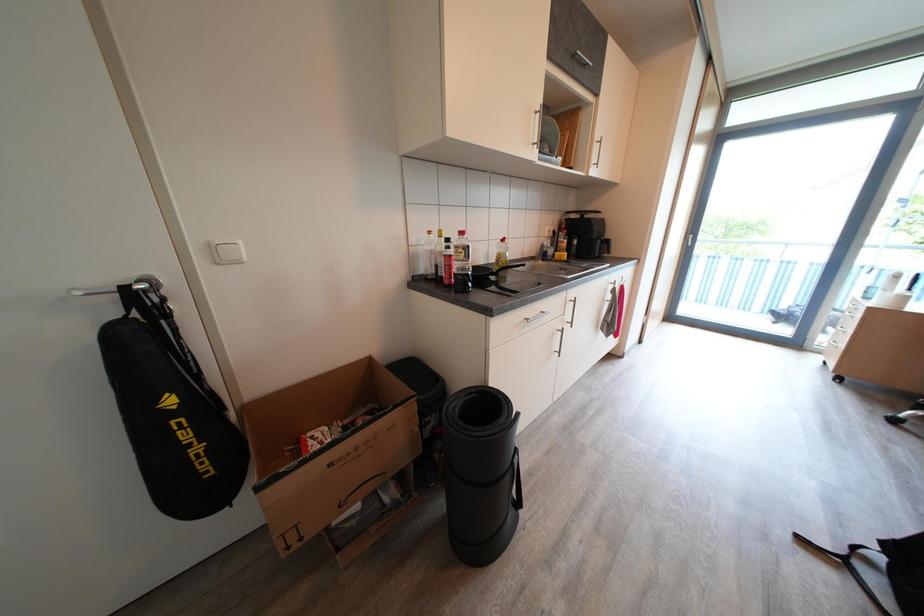
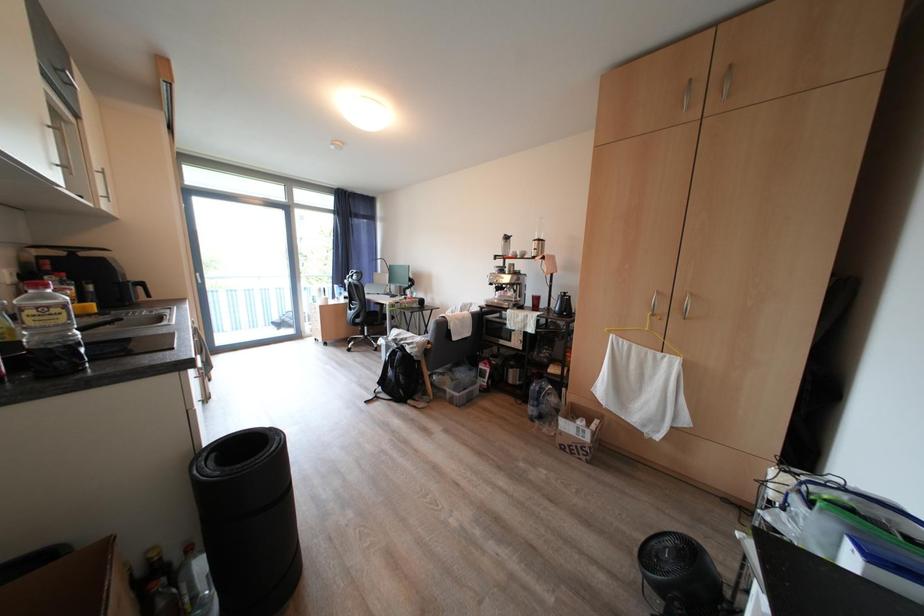
Question: How did the camera likely rotate?

Choices:
 (A) Left
 (B) Right
 (C) Up
 (D) Down

Answer: (B)